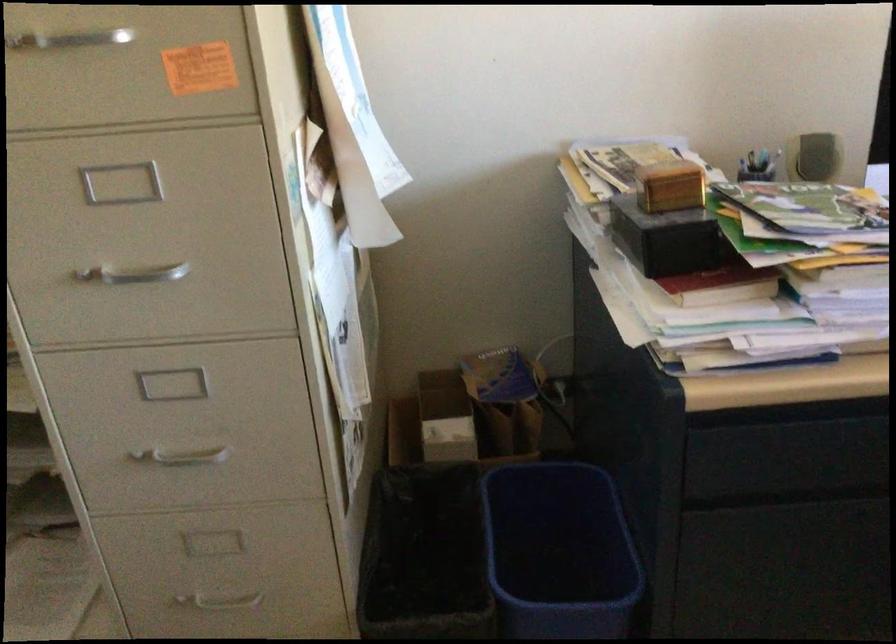
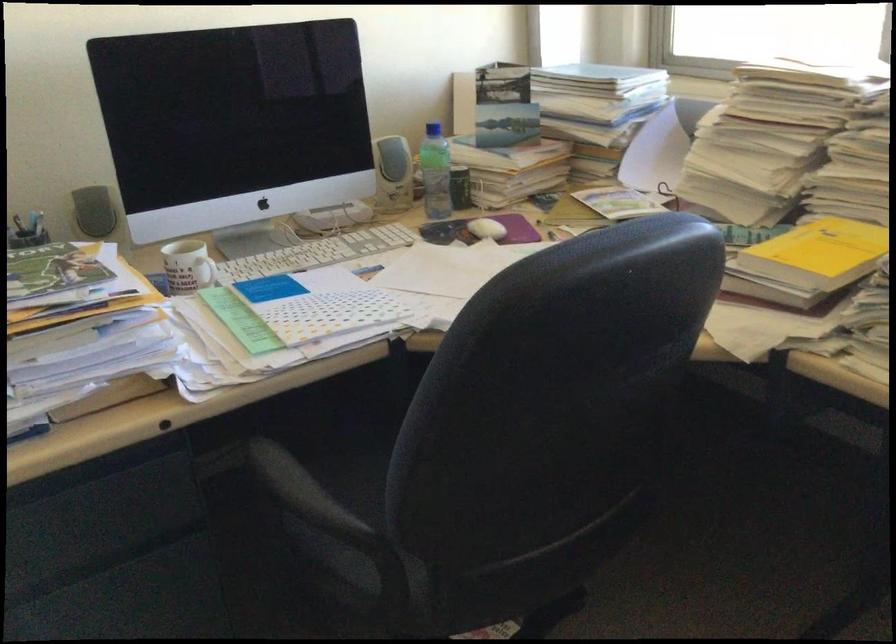
Find the pixel in the second image that matches pixel 817 158 in the first image.

(93, 211)